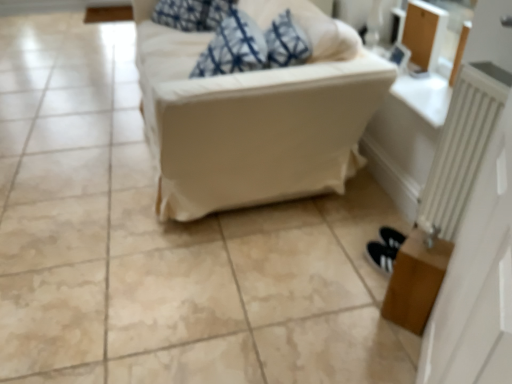
Question: Can you confirm if brown wooden table at lower right is shorter than white metallic radiator at right?

Choices:
 (A) yes
 (B) no

Answer: (A)

Question: Would you say brown wooden table at lower right contains white metallic radiator at right?

Choices:
 (A) yes
 (B) no

Answer: (B)

Question: From the image's perspective, is brown wooden table at lower right over white metallic radiator at right?

Choices:
 (A) no
 (B) yes

Answer: (A)

Question: From a real-world perspective, is brown wooden table at lower right below white metallic radiator at right?

Choices:
 (A) yes
 (B) no

Answer: (A)

Question: Considering the relative sizes of brown wooden table at lower right and white metallic radiator at right in the image provided, is brown wooden table at lower right wider than white metallic radiator at right?

Choices:
 (A) yes
 (B) no

Answer: (A)

Question: Is brown wooden table at lower right positioned beyond the bounds of white metallic radiator at right?

Choices:
 (A) yes
 (B) no

Answer: (A)

Question: From a real-world perspective, is white fabric couch at center located higher than brown wooden table at lower right?

Choices:
 (A) no
 (B) yes

Answer: (B)

Question: Can you confirm if white fabric couch at center is positioned to the left of brown wooden table at lower right?

Choices:
 (A) yes
 (B) no

Answer: (A)

Question: Is brown wooden table at lower right located within white fabric couch at center?

Choices:
 (A) yes
 (B) no

Answer: (B)

Question: Is white fabric couch at center positioned in front of brown wooden table at lower right?

Choices:
 (A) no
 (B) yes

Answer: (A)

Question: Does white fabric couch at center turn towards brown wooden table at lower right?

Choices:
 (A) no
 (B) yes

Answer: (A)

Question: Are white fabric couch at center and brown wooden table at lower right located far from each other?

Choices:
 (A) no
 (B) yes

Answer: (A)

Question: Can white fabric couch at center be found inside brown wooden table at lower right?

Choices:
 (A) yes
 (B) no

Answer: (B)